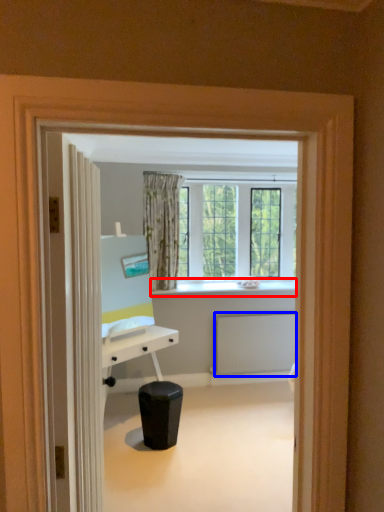
Question: Among these objects, which one is farthest to the camera, window sill (highlighted by a red box) or radiator (highlighted by a blue box)?

Choices:
 (A) window sill
 (B) radiator

Answer: (B)